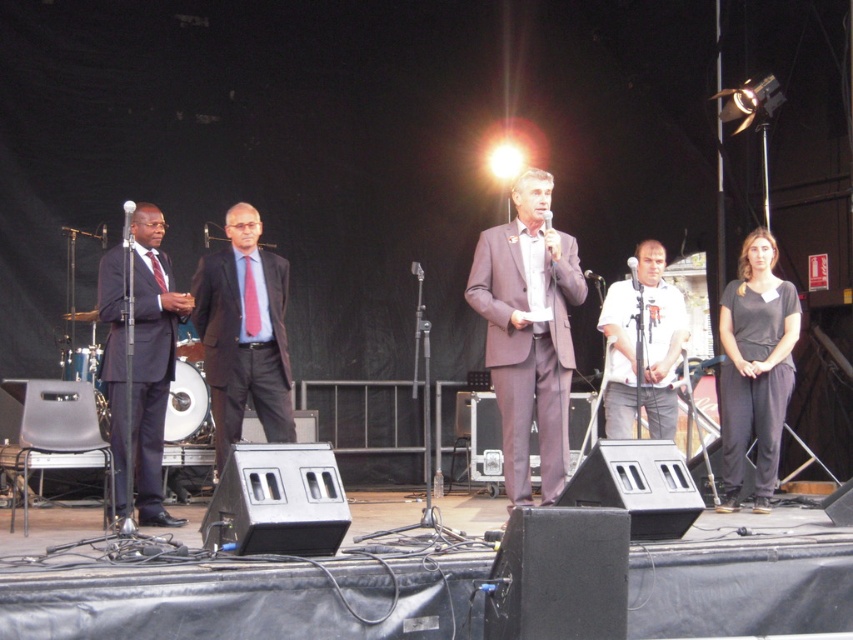
Question: Does black plastic microphone at center lie in front of black matte microphone at left?

Choices:
 (A) yes
 (B) no

Answer: (B)

Question: Which object is positioned farthest from the gray suit at center?

Choices:
 (A) matte black microphone at center
 (B) white cotton shirt at center
 (C) black matte microphone at left

Answer: (C)

Question: In this image, where is black matte microphone at left located relative to metallic silver microphone at center?

Choices:
 (A) above
 (B) below

Answer: (A)

Question: Which object is positioned closest to the matte black microphone at center?

Choices:
 (A) matte black suit at left
 (B) black plastic microphone at center

Answer: (B)

Question: Which of the following is the closest to the observer?

Choices:
 (A) black cotton pants at right
 (B) matte black suit at left
 (C) white cotton shirt at center

Answer: (B)

Question: Considering the relative positions of matte black suit at left and black matte microphone at left in the image provided, where is matte black suit at left located with respect to black matte microphone at left?

Choices:
 (A) above
 (B) below

Answer: (B)